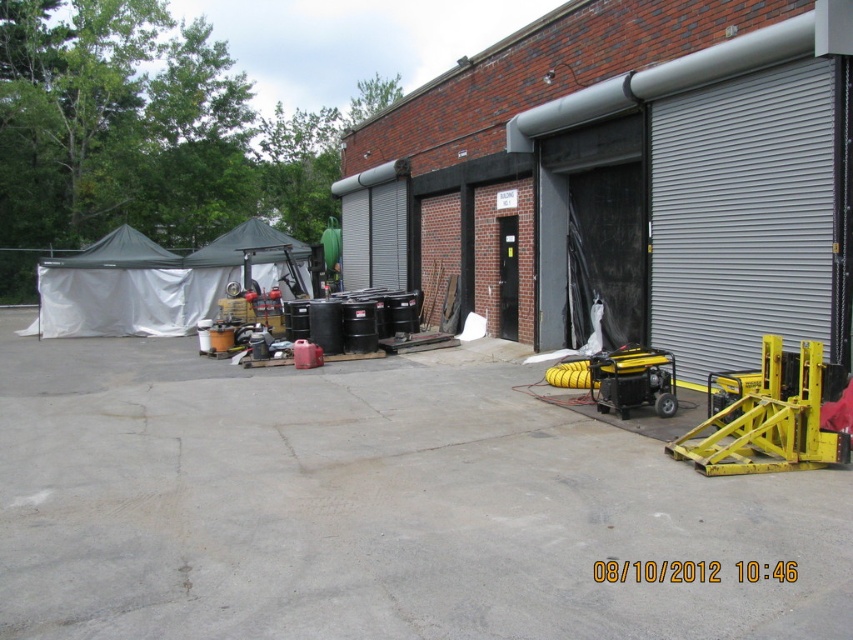
Between gray metallic garage door at right and yellow metallic generator at lower right, which one has more height?

gray metallic garage door at right is taller.

Who is higher up, gray metallic garage door at right or yellow metallic generator at lower right?

Positioned higher is gray metallic garage door at right.

In the scene shown: Who is more forward, (666, 252) or (608, 355)?

Point (608, 355) is more forward.

Find the location of a particular element. This screenshot has width=853, height=640. gray metallic garage door at right is located at coordinates (743, 216).

Measure the distance between metallic gray shed at center and camera.

metallic gray shed at center and camera are 7.08 meters apart.

In the scene shown: Who is more forward, (659, 36) or (643, 388)?

Positioned in front is point (643, 388).

Identify the location of metallic gray shed at center. This screenshot has height=640, width=853. (625, 179).

Is metallic gray shed at center positioned before yellow metallic forklift at right?

No.

Who is more distant from viewer, (746, 273) or (819, 458)?

The point (746, 273) is more distant.

Image resolution: width=853 pixels, height=640 pixels. Identify the location of metallic gray shed at center. (625, 179).